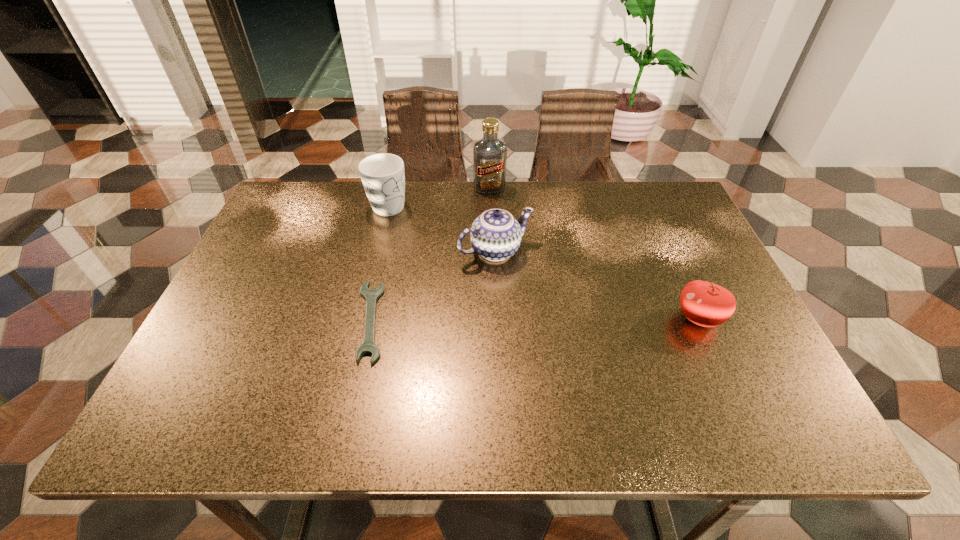
The height and width of the screenshot is (540, 960). In order to click on free space between the third nearest object and the wrench in this screenshot , I will do `click(433, 286)`.

Where is `vacant space that is in between the mug and the wrench`? The height and width of the screenshot is (540, 960). vacant space that is in between the mug and the wrench is located at coordinates (379, 263).

At what (x,y) coordinates should I click in order to perform the action: click on vacant space that's between the rightmost object and the shortest object. Please return your answer as a coordinate pair (x, y). This screenshot has width=960, height=540. Looking at the image, I should click on (535, 319).

The height and width of the screenshot is (540, 960). Identify the location of empty space between the wrench and the mug. (379, 263).

Locate an element on the screen. the third closest object to the chinaware is located at coordinates (489, 153).

Point out which object is positioned as the nearest to the wrench. Please provide its 2D coordinates. Your answer should be formatted as a tuple, i.e. [(x, y)], where the tuple contains the x and y coordinates of a point satisfying the conditions above.

[(495, 235)]

Locate an element on the screen. The image size is (960, 540). vacant space that satisfies the following two spatial constraints: 1. on the back side of the vodka; 2. on the left side of the shortest object is located at coordinates (400, 188).

You are a GUI agent. You are given a task and a screenshot of the screen. Output one action in this format:
    pyautogui.click(x=<x>, y=<y>)
    Task: Click on the free location that satisfies the following two spatial constraints: 1. on the front side of the rightmost object; 2. on the left side of the tallest object
    Image resolution: width=960 pixels, height=540 pixels.
    Given the screenshot: What is the action you would take?
    pyautogui.click(x=493, y=318)

Where is `free location that satisfies the following two spatial constraints: 1. on the back side of the wrench; 2. on the left side of the third nearest object`? This screenshot has height=540, width=960. free location that satisfies the following two spatial constraints: 1. on the back side of the wrench; 2. on the left side of the third nearest object is located at coordinates (386, 251).